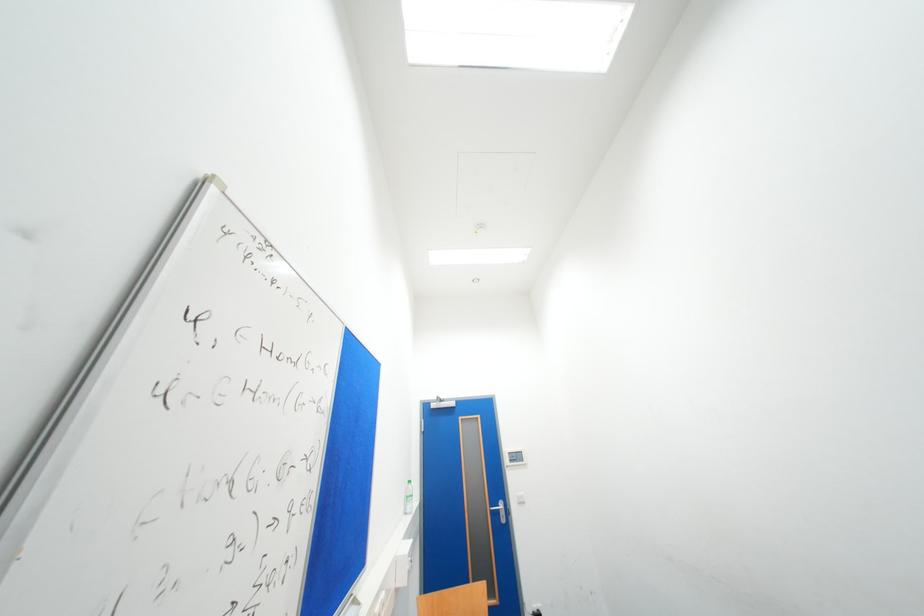
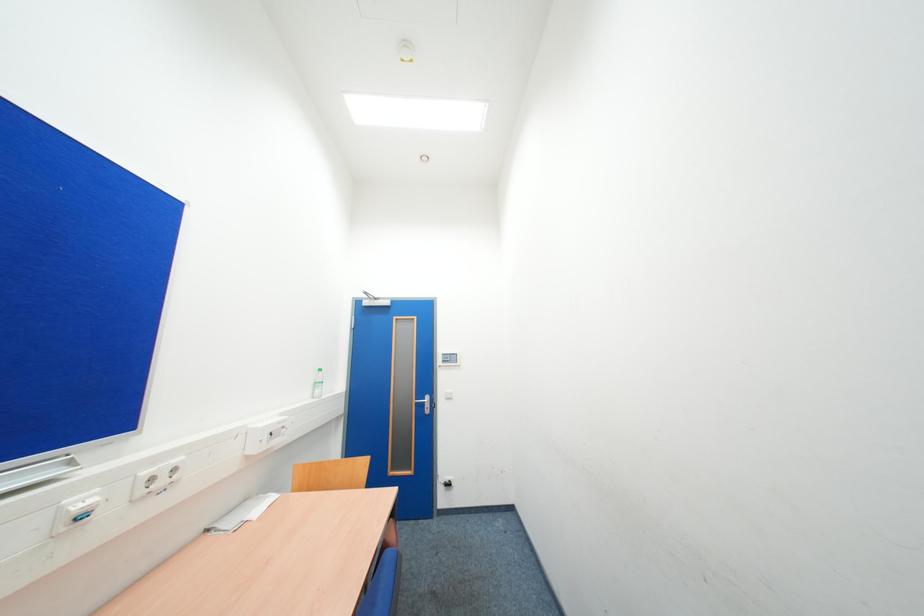
The images are taken continuously from a first-person perspective. In which direction are you moving?

The cameraman moved toward right, forward.